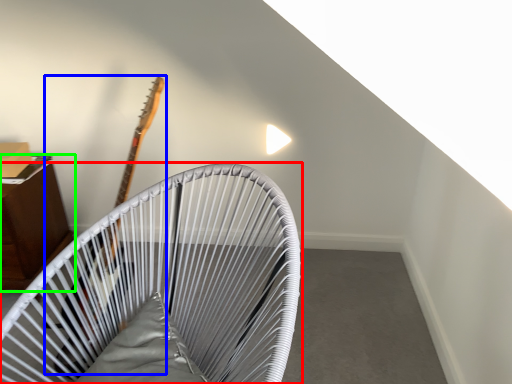
Question: Estimate the real-world distances between objects in this image. Which object is closer to furniture (highlighted by a red box), guitar (highlighted by a blue box) or furniture (highlighted by a green box)?

Choices:
 (A) guitar
 (B) furniture

Answer: (A)